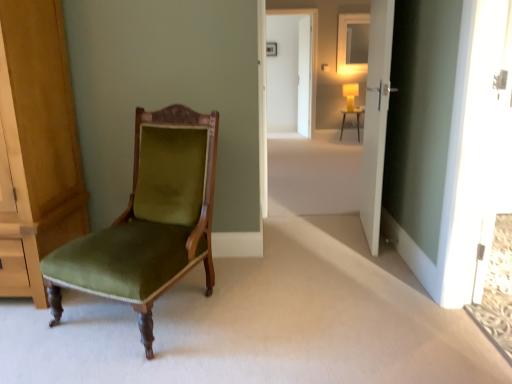
This screenshot has height=384, width=512. Identify the location of vacant space in velvet green chair at left (from a real-world perspective). (156, 311).